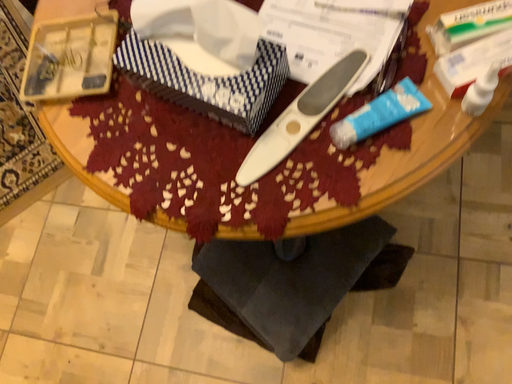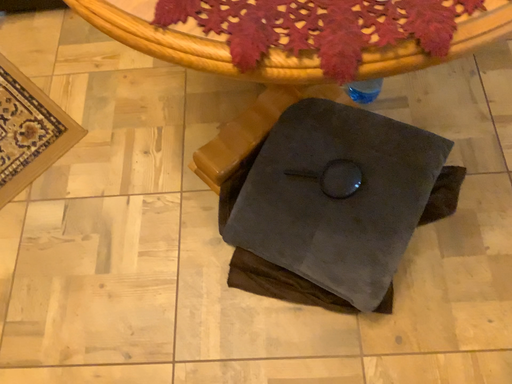
Question: Which way did the camera rotate in the video?

Choices:
 (A) rotated downward
 (B) rotated upward

Answer: (B)